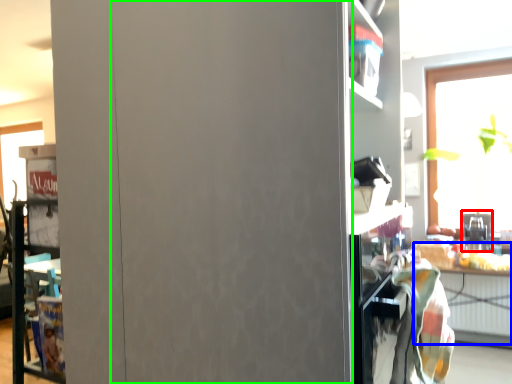
Question: Which object is positioned closest to appliance (highlighted by a red box)? Select from table (highlighted by a blue box) and garage door (highlighted by a green box).

Choices:
 (A) table
 (B) garage door

Answer: (A)